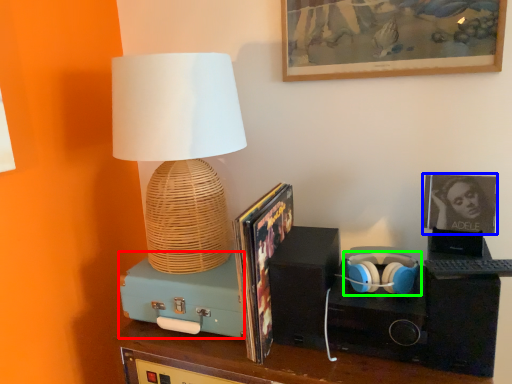
Question: Which is farther away from speaker (highlighted by a red box)? picture frame (highlighted by a blue box) or headphones (highlighted by a green box)?

Choices:
 (A) picture frame
 (B) headphones

Answer: (A)